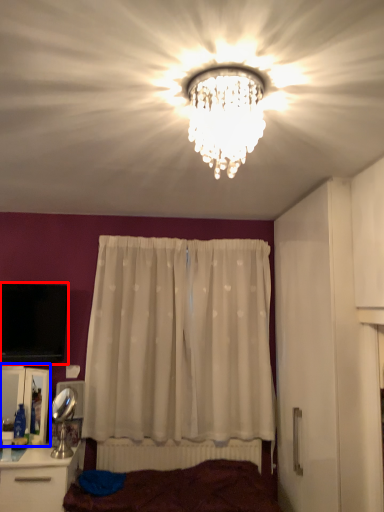
Question: Among these objects, which one is farthest to the camera, television (highlighted by a red box) or cabinetry (highlighted by a blue box)?

Choices:
 (A) television
 (B) cabinetry

Answer: (A)